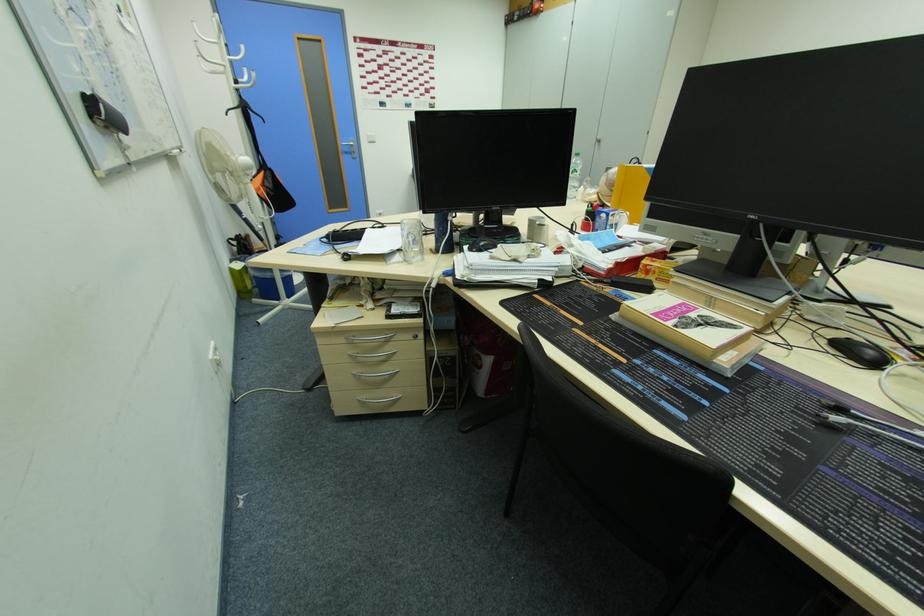
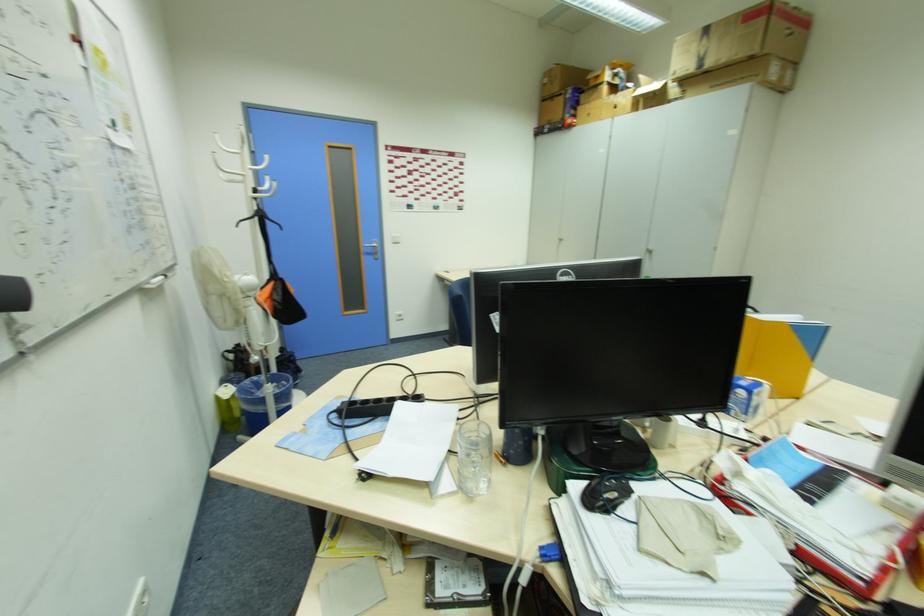
In the second image, find the point that corresponds to [235,270] in the first image.

(220, 400)